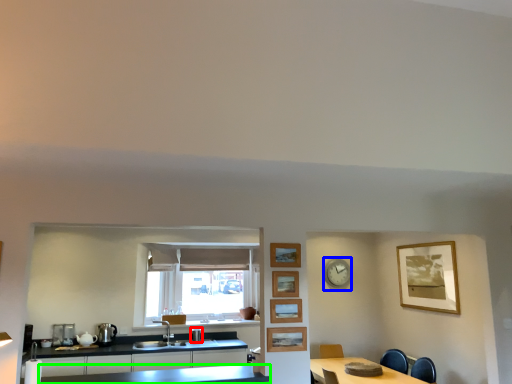
Question: Based on their relative distances, which object is nearer to appliance (highlighted by a red box)? Choose from clock (highlighted by a blue box) and countertop (highlighted by a green box).

Choices:
 (A) clock
 (B) countertop

Answer: (B)